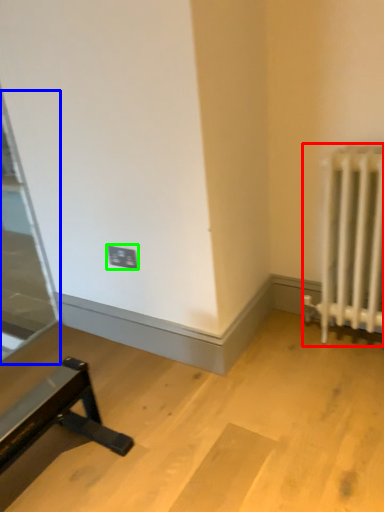
Question: Based on their relative distances, which object is nearer to radiator (highlighted by a red box)? Choose from glass door (highlighted by a blue box) and electric outlet (highlighted by a green box).

Choices:
 (A) glass door
 (B) electric outlet

Answer: (B)